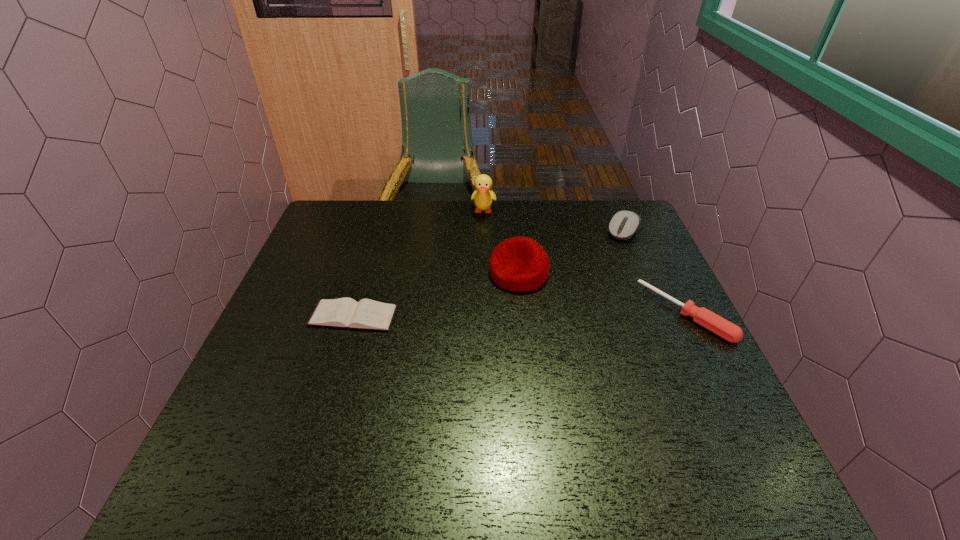
Image resolution: width=960 pixels, height=540 pixels. Find the location of `vacant space situated on the front-facing side of the duckling`. vacant space situated on the front-facing side of the duckling is located at coordinates (480, 262).

Find the location of a particular element. This screenshot has height=540, width=960. blank space located 0.310m on the wheel side of the computer equipment is located at coordinates (578, 301).

Where is `vacant point located on the wheel side of the computer equipment`? vacant point located on the wheel side of the computer equipment is located at coordinates (587, 288).

This screenshot has width=960, height=540. I want to click on free spot located 0.370m on the wheel side of the computer equipment, so click(x=568, y=315).

Locate an element on the screen. free location located on the seat area of the second tallest object is located at coordinates (399, 389).

Locate an element on the screen. vacant space located 0.120m on the seat area of the second tallest object is located at coordinates (475, 315).

Image resolution: width=960 pixels, height=540 pixels. Find the location of `blank space located on the seat area of the second tallest object`. blank space located on the seat area of the second tallest object is located at coordinates (430, 359).

At what (x,y) coordinates should I click in order to perform the action: click on duckling that is at the far edge. Please return your answer as a coordinate pair (x, y). This screenshot has height=540, width=960. Looking at the image, I should click on (483, 197).

You are a GUI agent. You are given a task and a screenshot of the screen. Output one action in this format:
    pyautogui.click(x=<x>, y=<y>)
    Task: Click on the computer equipment that is at the far edge
    Image resolution: width=960 pixels, height=540 pixels.
    Given the screenshot: What is the action you would take?
    pyautogui.click(x=623, y=225)

The width and height of the screenshot is (960, 540). Find the location of `object that is at the left edge`. object that is at the left edge is located at coordinates (367, 314).